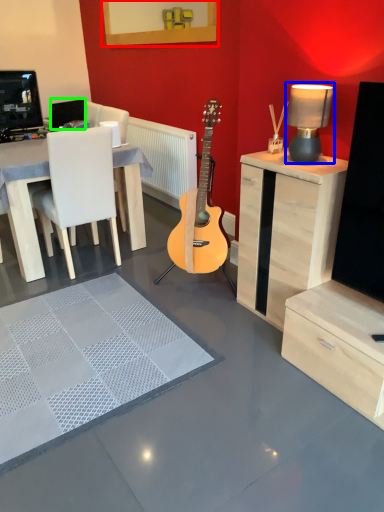
Question: Which is nearer to the picture frame (highlighted by a red box)? table lamp (highlighted by a blue box) or speaker (highlighted by a green box).

Choices:
 (A) table lamp
 (B) speaker

Answer: (B)